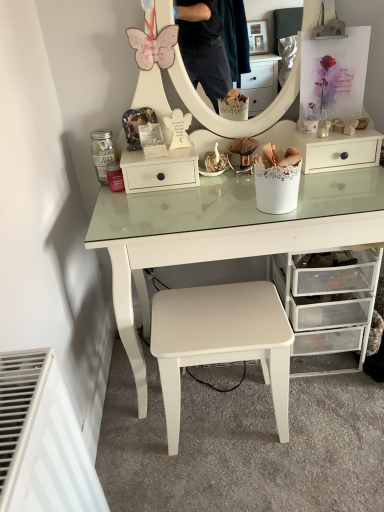
The image size is (384, 512). I want to click on vacant point above white matte stool at center (from a real-world perspective), so click(211, 315).